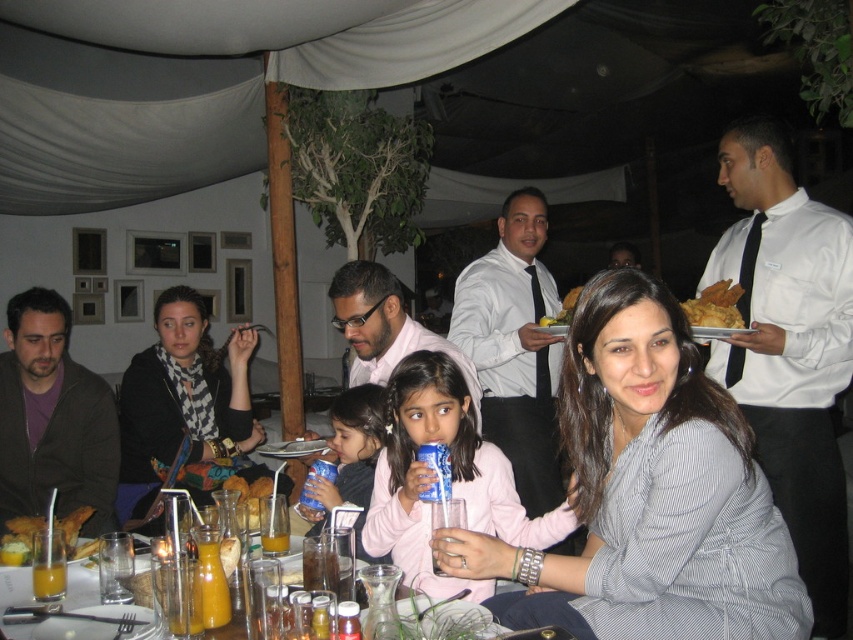
Which of these two, white satin shirt at right or orange juice glass at center, stands shorter?

Standing shorter between the two is orange juice glass at center.

The height and width of the screenshot is (640, 853). I want to click on white satin shirt at right, so click(x=788, y=348).

This screenshot has height=640, width=853. In order to click on white satin shirt at right in this screenshot , I will do `click(788, 348)`.

Is gray striped shirt at center shorter than orange juice at lower left?

No.

Can you confirm if gray striped shirt at center is thinner than orange juice at lower left?

Incorrect, gray striped shirt at center's width is not less than orange juice at lower left's.

Locate an element on the screen. The width and height of the screenshot is (853, 640). gray striped shirt at center is located at coordinates pyautogui.click(x=648, y=493).

Is white satin shirt at right bigger than golden crispy bread at upper right?

Yes, white satin shirt at right is bigger than golden crispy bread at upper right.

Is white satin shirt at right wider than golden crispy bread at upper right?

Correct, the width of white satin shirt at right exceeds that of golden crispy bread at upper right.

This screenshot has width=853, height=640. Describe the element at coordinates (788, 348) in the screenshot. I see `white satin shirt at right` at that location.

Where is `white satin shirt at right`? white satin shirt at right is located at coordinates (788, 348).